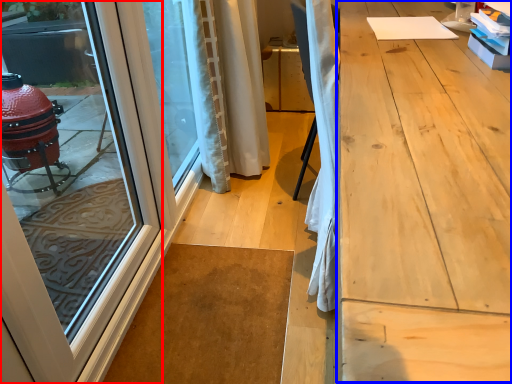
Question: Which point is closer to the camera, door (highlighted by a red box) or workbench (highlighted by a blue box)?

Choices:
 (A) door
 (B) workbench

Answer: (B)